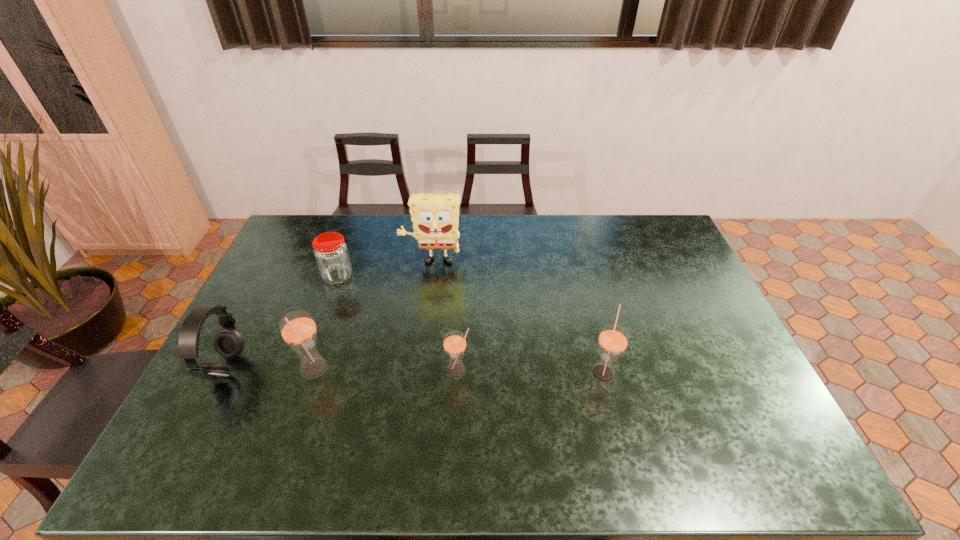
Identify the location of the leftmost straw. This screenshot has height=540, width=960. (298, 329).

You are a GUI agent. You are given a task and a screenshot of the screen. Output one action in this format:
    pyautogui.click(x=<x>, y=<y>)
    Task: Click on the second straw from left to right
    
    Given the screenshot: What is the action you would take?
    pyautogui.click(x=454, y=343)

Where is `the rightmost straw`? the rightmost straw is located at coordinates (613, 339).

At what (x,y) coordinates should I click in order to perform the action: click on the second tallest straw. Please return your answer as a coordinate pair (x, y). Looking at the image, I should click on (613, 339).

Image resolution: width=960 pixels, height=540 pixels. In order to click on jar in this screenshot , I will do `click(331, 254)`.

You are a GUI agent. You are given a task and a screenshot of the screen. Output one action in this format:
    pyautogui.click(x=<x>, y=<y>)
    Task: Click on the sponge
    
    Given the screenshot: What is the action you would take?
    pyautogui.click(x=435, y=217)

You are a GUI agent. You are given a task and a screenshot of the screen. Output one action in this format:
    pyautogui.click(x=<x>, y=<y>)
    Task: Click on the leftmost object
    The width and height of the screenshot is (960, 540).
    Given the screenshot: What is the action you would take?
    pyautogui.click(x=228, y=343)

Locate an element on the screen. Image resolution: width=960 pixels, height=540 pixels. vacant space situated 0.220m on the back of the leftmost straw is located at coordinates pos(337,301).

Image resolution: width=960 pixels, height=540 pixels. In order to click on vacant space located on the left of the second straw from left to right in this screenshot , I will do `click(420, 371)`.

Locate an element on the screen. The height and width of the screenshot is (540, 960). free point located 0.270m on the right of the rightmost straw is located at coordinates (715, 372).